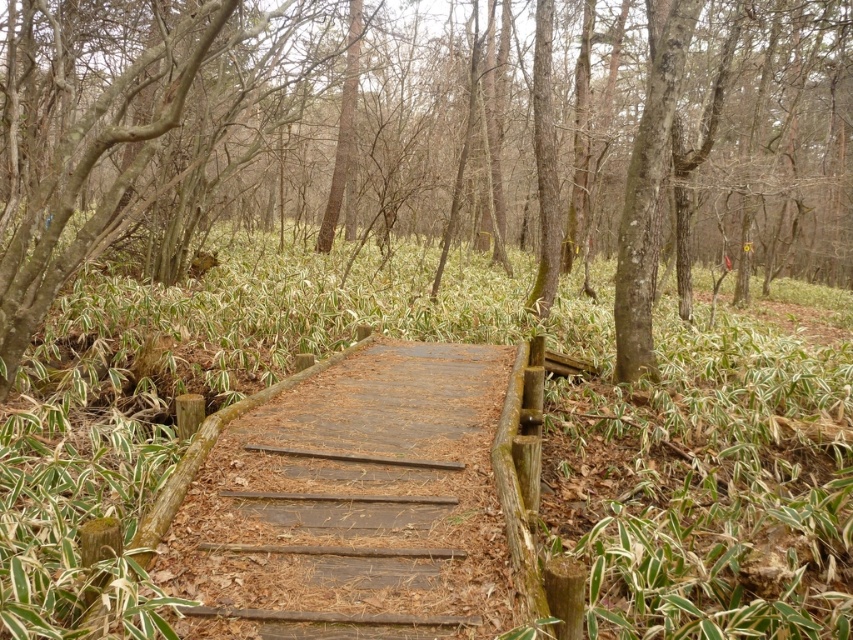
Who is positioned more to the right, brown wood bridge at center or green leafy plants at center?

brown wood bridge at center is more to the right.

What do you see at coordinates (415, 131) in the screenshot?
I see `brown wood bridge at center` at bounding box center [415, 131].

Measure the distance between point (720, 16) and camera.

Point (720, 16) is 15.51 meters from camera.

Locate an element on the screen. brown wood bridge at center is located at coordinates (415, 131).

Is brown wood bridge at center above weathered wood path at center?

Yes, brown wood bridge at center is above weathered wood path at center.

Who is more forward, (664,84) or (355,406)?

Positioned in front is point (355,406).

Where is `brown wood bridge at center`? brown wood bridge at center is located at coordinates (415, 131).

The image size is (853, 640). What do you see at coordinates (460, 340) in the screenshot?
I see `green leafy plants at center` at bounding box center [460, 340].

Does point (735, 481) come closer to viewer compared to point (422, 550)?

No.

Between point (637, 589) and point (347, 524), which one is positioned behind?

Positioned behind is point (347, 524).

This screenshot has width=853, height=640. Identify the location of green leafy plants at center. (460, 340).